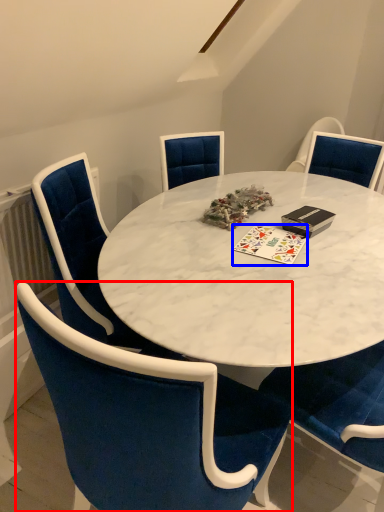
Question: Among these objects, which one is nearest to the camera, chair (highlighted by a red box) or card game (highlighted by a blue box)?

Choices:
 (A) chair
 (B) card game

Answer: (A)